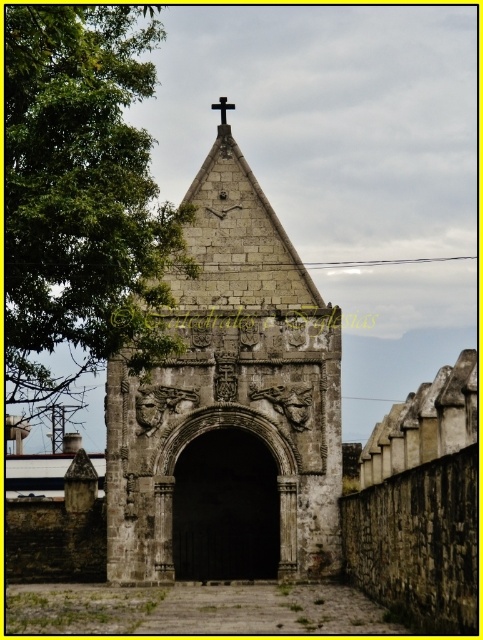
Is gray stone church at center wider than green leafy tree at left?

Incorrect, gray stone church at center's width does not surpass green leafy tree at left's.

Is gray stone church at center behind green leafy tree at left?

Yes, gray stone church at center is behind green leafy tree at left.

Between point (296, 388) and point (48, 285), which one is positioned in front?

Point (48, 285) is more forward.

Where is `gray stone church at center`? The width and height of the screenshot is (483, 640). gray stone church at center is located at coordinates (230, 406).

Is green leafy tree at left below black stone cross at top?

Yes.

Is point (102, 49) positioned behind point (227, 100)?

No, it is in front of (227, 100).

Identify the location of green leafy tree at left. This screenshot has height=640, width=483. (82, 196).

Consider the image. Is gray stone church at center smaller than black stone cross at top?

Actually, gray stone church at center might be larger than black stone cross at top.

Between gray stone church at center and black stone cross at top, which one is positioned lower?

gray stone church at center is below.

Between point (294, 328) and point (228, 108), which one is positioned in front?

Point (294, 328)

Locate an element on the screen. The width and height of the screenshot is (483, 640). gray stone church at center is located at coordinates (230, 406).